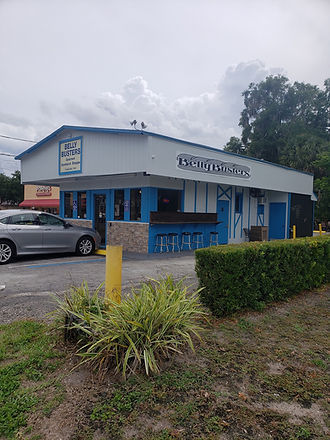
Where is `door`? The image size is (330, 440). door is located at coordinates (97, 210), (278, 219), (223, 218).